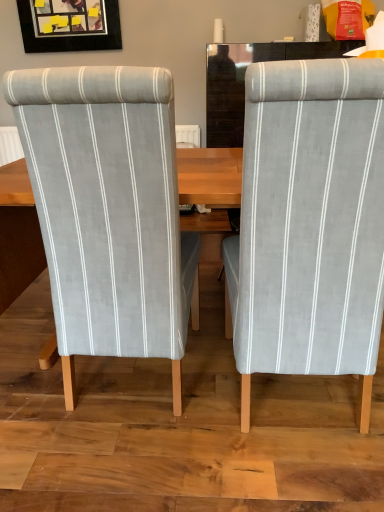
Where is `free area in between light gray fabric chair at left, the 2th chair positioned from the right, and light gray fabric chair at right, which is the second chair in left-to-right order`? This screenshot has width=384, height=512. free area in between light gray fabric chair at left, the 2th chair positioned from the right, and light gray fabric chair at right, which is the second chair in left-to-right order is located at coordinates (194, 387).